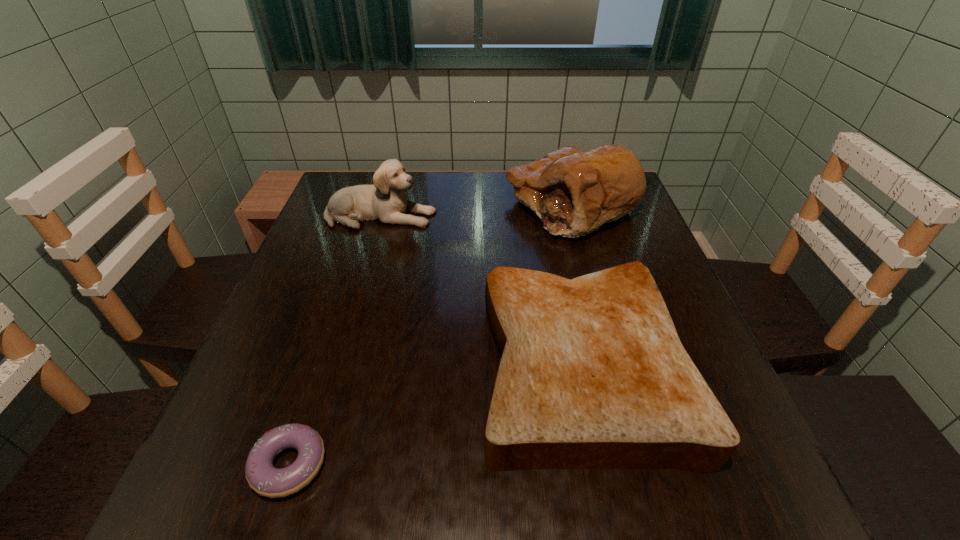
Where is `the tallest object`? The width and height of the screenshot is (960, 540). the tallest object is located at coordinates (573, 192).

You are a GUI agent. You are given a task and a screenshot of the screen. Output one action in this format:
    pyautogui.click(x=<x>, y=<y>)
    Task: Click on the farther bread
    The height and width of the screenshot is (540, 960).
    Given the screenshot: What is the action you would take?
    pyautogui.click(x=573, y=192)

At what (x,y) coordinates should I click in order to perform the action: click on puppy. Please return your answer as a coordinate pair (x, y). The height and width of the screenshot is (540, 960). Looking at the image, I should click on (385, 201).

This screenshot has width=960, height=540. I want to click on the shorter bread, so click(x=593, y=374).

Locate an element on the screen. the nearer bread is located at coordinates (593, 374).

Where is `doughnut`? doughnut is located at coordinates (265, 479).

At what (x,y) coordinates should I click in order to perform the action: click on vacant area located 0.400m on the filling side of the taller bread. Please return your answer as a coordinate pair (x, y). Looking at the image, I should click on (358, 206).

Locate an element on the screen. vacant area located on the filling side of the taller bread is located at coordinates (410, 206).

Locate an element on the screen. Image resolution: width=960 pixels, height=540 pixels. vacant area situated on the filling side of the taller bread is located at coordinates (420, 206).

You are a GUI agent. You are given a task and a screenshot of the screen. Output one action in this format:
    pyautogui.click(x=<x>, y=<y>)
    Task: Click on the blank space located 0.240m on the front-facing side of the second tallest object
    
    Given the screenshot: What is the action you would take?
    pyautogui.click(x=527, y=215)